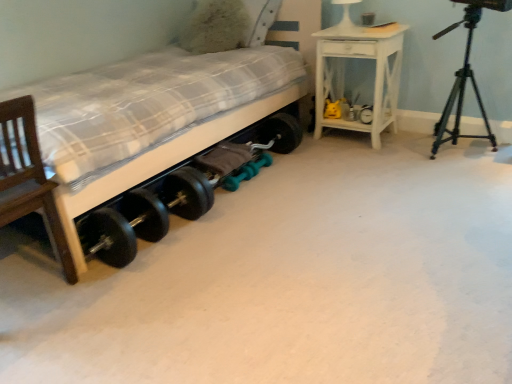
Question: Does fluffy white pillow at upper center have a greater height compared to white painted wood nightstand at upper right?

Choices:
 (A) no
 (B) yes

Answer: (A)

Question: Is fluffy white pillow at upper center positioned behind white painted wood nightstand at upper right?

Choices:
 (A) yes
 (B) no

Answer: (A)

Question: Is fluffy white pillow at upper center facing towards white painted wood nightstand at upper right?

Choices:
 (A) no
 (B) yes

Answer: (A)

Question: Is fluffy white pillow at upper center far from white painted wood nightstand at upper right?

Choices:
 (A) yes
 (B) no

Answer: (B)

Question: Considering the relative sizes of fluffy white pillow at upper center and white painted wood nightstand at upper right in the image provided, is fluffy white pillow at upper center thinner than white painted wood nightstand at upper right?

Choices:
 (A) no
 (B) yes

Answer: (B)

Question: Is point (321, 120) closer or farther from the camera than point (28, 97)?

Choices:
 (A) farther
 (B) closer

Answer: (A)

Question: Is white painted wood nightstand at upper right wider or thinner than wooden chair at left?

Choices:
 (A) wide
 (B) thin

Answer: (A)

Question: From the image's perspective, relative to wooden chair at left, is white painted wood nightstand at upper right above or below?

Choices:
 (A) above
 (B) below

Answer: (A)

Question: Considering the relative positions of white painted wood nightstand at upper right and wooden chair at left in the image provided, is white painted wood nightstand at upper right to the left or to the right of wooden chair at left?

Choices:
 (A) right
 (B) left

Answer: (A)

Question: In the image, is black metal tripod at right positioned in front of or behind wooden bed at lower left?

Choices:
 (A) front
 (B) behind

Answer: (B)

Question: Considering the positions of black metal tripod at right and wooden bed at lower left in the image, is black metal tripod at right bigger or smaller than wooden bed at lower left?

Choices:
 (A) small
 (B) big

Answer: (A)

Question: From a real-world perspective, relative to wooden bed at lower left, is black metal tripod at right vertically above or below?

Choices:
 (A) above
 (B) below

Answer: (B)

Question: From the image's perspective, is black metal tripod at right positioned above or below wooden bed at lower left?

Choices:
 (A) above
 (B) below

Answer: (A)

Question: Would you say wooden bed at lower left is inside or outside wooden chair at left?

Choices:
 (A) inside
 (B) outside

Answer: (B)

Question: In terms of height, does wooden bed at lower left look taller or shorter compared to wooden chair at left?

Choices:
 (A) tall
 (B) short

Answer: (A)